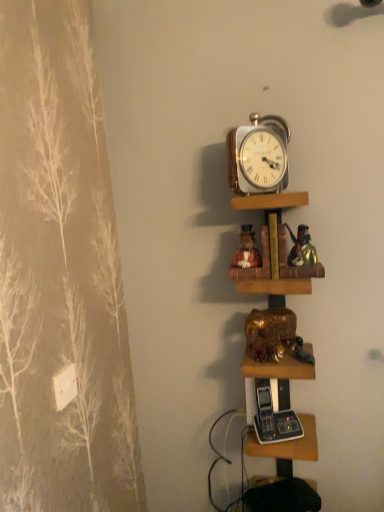
Question: From the image's perspective, is matte ceramic figurines at center, arranged as the first shelf when viewed from the top, under gold metallic alarm clock at upper center?

Choices:
 (A) no
 (B) yes

Answer: (B)

Question: Does matte ceramic figurines at center, arranged as the first shelf when viewed from the top, have a greater height compared to gold metallic alarm clock at upper center?

Choices:
 (A) no
 (B) yes

Answer: (A)

Question: Is matte ceramic figurines at center, arranged as the first shelf when viewed from the top, positioned far away from gold metallic alarm clock at upper center?

Choices:
 (A) yes
 (B) no

Answer: (B)

Question: Is matte ceramic figurines at center, the 2th shelf from the bottom, bigger than gold metallic alarm clock at upper center?

Choices:
 (A) yes
 (B) no

Answer: (A)

Question: Is matte ceramic figurines at center, arranged as the first shelf when viewed from the top, positioned before gold metallic alarm clock at upper center?

Choices:
 (A) yes
 (B) no

Answer: (B)

Question: Considering the positions of point (266, 354) and point (253, 201), is point (266, 354) closer or farther from the camera than point (253, 201)?

Choices:
 (A) closer
 (B) farther

Answer: (B)

Question: Is gold metallic elephant at center in front of or behind matte ceramic figurines at center, the 2th shelf from the bottom, in the image?

Choices:
 (A) behind
 (B) front

Answer: (A)

Question: From the image's perspective, is gold metallic elephant at center positioned above or below matte ceramic figurines at center, the 2th shelf from the bottom?

Choices:
 (A) above
 (B) below

Answer: (B)

Question: Based on their sizes in the image, would you say gold metallic elephant at center is bigger or smaller than matte ceramic figurines at center, arranged as the first shelf when viewed from the top?

Choices:
 (A) big
 (B) small

Answer: (B)

Question: In the image, is matte ceramic figurines at center, the 2th shelf from the bottom, on the left side or the right side of wooden shelves at center, positioned as the 1th shelf in bottom-to-top order?

Choices:
 (A) right
 (B) left

Answer: (B)

Question: Is matte ceramic figurines at center, the 2th shelf from the bottom, wider or thinner than wooden shelves at center, positioned as the second shelf in top-to-bottom order?

Choices:
 (A) wide
 (B) thin

Answer: (B)

Question: In terms of size, does matte ceramic figurines at center, the 2th shelf from the bottom, appear bigger or smaller than wooden shelves at center, positioned as the second shelf in top-to-bottom order?

Choices:
 (A) big
 (B) small

Answer: (B)

Question: From a real-world perspective, relative to wooden shelves at center, positioned as the 1th shelf in bottom-to-top order, is matte ceramic figurines at center, the 2th shelf from the bottom, vertically above or below?

Choices:
 (A) above
 (B) below

Answer: (A)

Question: From a real-world perspective, is gold metallic alarm clock at upper center positioned above or below gold metallic elephant at center?

Choices:
 (A) above
 (B) below

Answer: (A)

Question: In terms of size, does gold metallic alarm clock at upper center appear bigger or smaller than gold metallic elephant at center?

Choices:
 (A) small
 (B) big

Answer: (A)